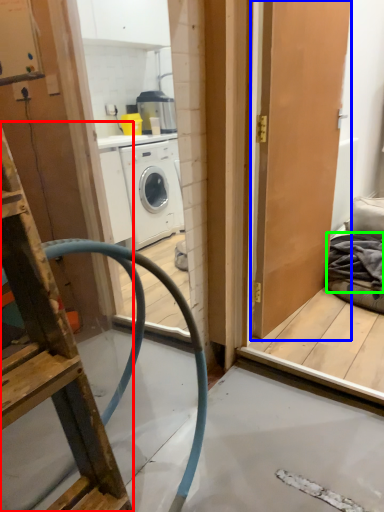
Question: Estimate the real-world distances between objects in this image. Which object is closer to ladder (highlighted by a red box), door (highlighted by a blue box) or material (highlighted by a green box)?

Choices:
 (A) door
 (B) material

Answer: (A)